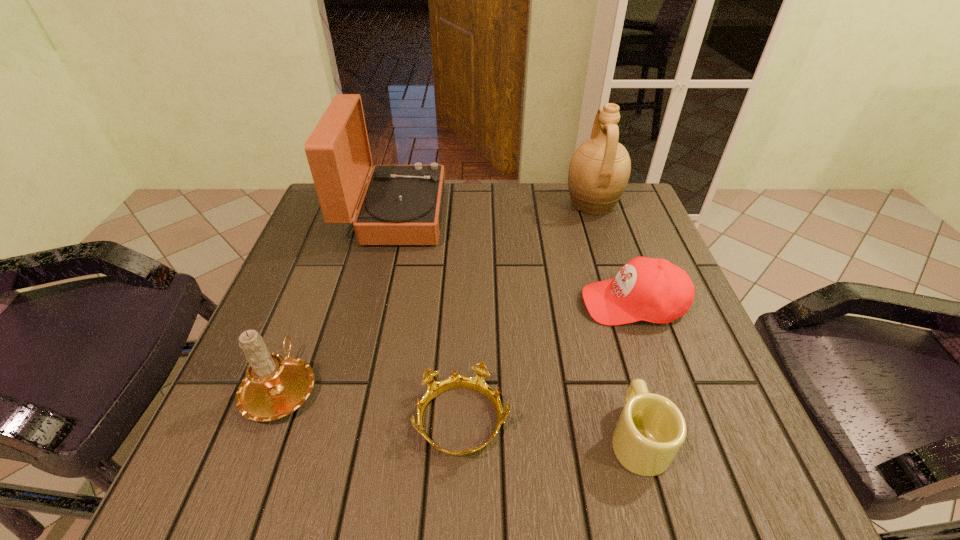
Locate an element on the screen. The image size is (960, 540). vacant area located on the front panel of the fourth nearest object is located at coordinates (405, 303).

Image resolution: width=960 pixels, height=540 pixels. Find the location of `vacant area located on the front panel of the fourth nearest object`. vacant area located on the front panel of the fourth nearest object is located at coordinates (463, 303).

Locate an element on the screen. free space located with the handle on the side of the mug is located at coordinates click(x=603, y=312).

In order to click on free space located with the handle on the side of the mug in this screenshot , I will do `click(612, 342)`.

Find the location of a particular element. Image resolution: width=960 pixels, height=540 pixels. vacant space situated 0.150m with the handle on the side of the mug is located at coordinates (609, 334).

Image resolution: width=960 pixels, height=540 pixels. Find the location of `vacant area situated 0.250m on the back of the crown`. vacant area situated 0.250m on the back of the crown is located at coordinates (467, 284).

Identify the location of pitcher that is at the far edge. This screenshot has height=540, width=960. (599, 170).

Identify the location of phonograph record located at the far edge. The width and height of the screenshot is (960, 540). (402, 204).

Where is `mug positioned at the near edge`? This screenshot has height=540, width=960. mug positioned at the near edge is located at coordinates (651, 429).

Where is `crown that is at the near edge`? Image resolution: width=960 pixels, height=540 pixels. crown that is at the near edge is located at coordinates (477, 383).